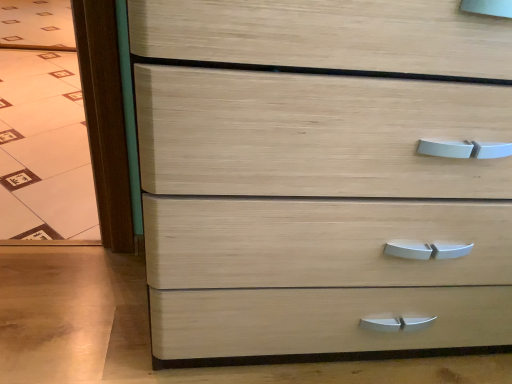
What is the approximate height of transparent glass door at left?

transparent glass door at left is 1.37 inches tall.

What do you see at coordinates (42, 127) in the screenshot?
I see `transparent glass door at left` at bounding box center [42, 127].

Measure the distance between point (x=63, y=21) and camera.

Point (x=63, y=21) and camera are 9.72 feet apart from each other.

Identify the location of transparent glass door at left. (42, 127).

In order to face natural wood chest of drawers at center, should I rotate leftwards or rightwards?

You should rotate right by 17.717 degrees.

This screenshot has height=384, width=512. What are the coordinates of `natural wood chest of drawers at center` in the screenshot? It's located at (321, 175).

Measure the distance between point (x=211, y=256) and camera.

Point (x=211, y=256) is 27.52 inches away from camera.

The image size is (512, 384). What do you see at coordinates (321, 175) in the screenshot?
I see `natural wood chest of drawers at center` at bounding box center [321, 175].

Image resolution: width=512 pixels, height=384 pixels. I want to click on transparent glass door at left, so click(42, 127).

Which is more to the left, transparent glass door at left or natural wood chest of drawers at center?

transparent glass door at left.

Considering the positions of objects transparent glass door at left and natural wood chest of drawers at center in the image provided, who is in front, transparent glass door at left or natural wood chest of drawers at center?

natural wood chest of drawers at center is closer to the camera.

Considering the positions of point (74, 164) and point (475, 60), is point (74, 164) closer or farther from the camera than point (475, 60)?

Point (74, 164) is positioned farther from the camera compared to point (475, 60).

From the image's perspective, between transparent glass door at left and natural wood chest of drawers at center, who is located below?

natural wood chest of drawers at center appears lower in the image.

From a real-world perspective, is transparent glass door at left positioned above or below natural wood chest of drawers at center?

From a real-world perspective, transparent glass door at left is physically below natural wood chest of drawers at center.

Does transparent glass door at left have a lesser width compared to natural wood chest of drawers at center?

Incorrect, the width of transparent glass door at left is not less than that of natural wood chest of drawers at center.

Which of these two, transparent glass door at left or natural wood chest of drawers at center, stands taller?

With more height is natural wood chest of drawers at center.

Can you confirm if transparent glass door at left is smaller than natural wood chest of drawers at center?

Correct, transparent glass door at left occupies less space than natural wood chest of drawers at center.

Would you say transparent glass door at left contains natural wood chest of drawers at center?

Definitely not — natural wood chest of drawers at center is not inside transparent glass door at left.

Is transparent glass door at left not close to natural wood chest of drawers at center?

No, transparent glass door at left is not far from natural wood chest of drawers at center.

Based on the photo, is natural wood chest of drawers at center at the back of transparent glass door at left?

transparent glass door at left is not turned away from natural wood chest of drawers at center.

Where is `glass door behind the natural wood chest of drawers at center`? Image resolution: width=512 pixels, height=384 pixels. glass door behind the natural wood chest of drawers at center is located at coordinates (42, 127).

Is natural wood chest of drawers at center to the left or to the right of transparent glass door at left in the image?

From the image, it's evident that natural wood chest of drawers at center is to the right of transparent glass door at left.

In the image, is natural wood chest of drawers at center positioned in front of or behind transparent glass door at left?

Clearly, natural wood chest of drawers at center is in front of transparent glass door at left.

Is point (165, 337) positioned after point (89, 165)?

No, (165, 337) is closer to viewer.

From the image's perspective, between natural wood chest of drawers at center and transparent glass door at left, which one is located above?

transparent glass door at left appears higher in the image.

From a real-world perspective, which is physically below, natural wood chest of drawers at center or transparent glass door at left?

In real-world perspective, transparent glass door at left is lower.

Considering the relative sizes of natural wood chest of drawers at center and transparent glass door at left in the image provided, is natural wood chest of drawers at center thinner than transparent glass door at left?

Yes.

Who is shorter, natural wood chest of drawers at center or transparent glass door at left?

With less height is transparent glass door at left.

Can you confirm if natural wood chest of drawers at center is smaller than transparent glass door at left?

Incorrect, natural wood chest of drawers at center is not smaller in size than transparent glass door at left.

Can we say natural wood chest of drawers at center lies outside transparent glass door at left?

Absolutely, natural wood chest of drawers at center is external to transparent glass door at left.

Is natural wood chest of drawers at center placed right next to transparent glass door at left?

They are not placed beside each other.

Could you tell me if natural wood chest of drawers at center is turned towards transparent glass door at left?

No, natural wood chest of drawers at center does not turn towards transparent glass door at left.

How different are the orientations of natural wood chest of drawers at center and transparent glass door at left in degrees?

natural wood chest of drawers at center and transparent glass door at left are facing 0.382 degrees away from each other.

Identify the location of the chest of drawers in front of the transparent glass door at left. (321, 175).

You are a GUI agent. You are given a task and a screenshot of the screen. Output one action in this format:
    pyautogui.click(x=<x>, y=<y>)
    Task: Click on the glass door behind the natural wood chest of drawers at center
    The image size is (512, 384).
    Given the screenshot: What is the action you would take?
    pyautogui.click(x=42, y=127)

At what (x,y) coordinates should I click in order to perform the action: click on chest of drawers in front of the transparent glass door at left. Please return your answer as a coordinate pair (x, y). The image size is (512, 384). Looking at the image, I should click on (321, 175).